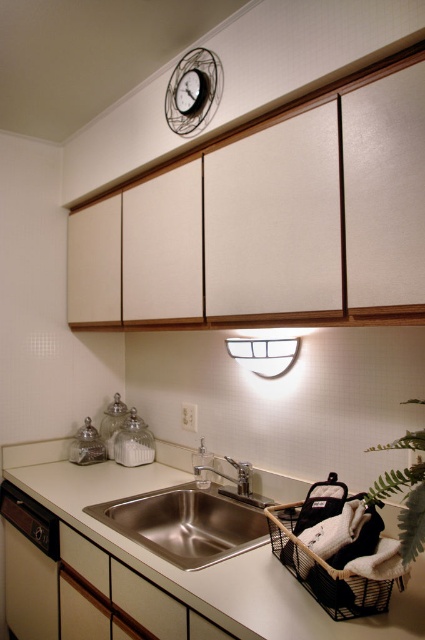
Question: Can you confirm if stainless steel sink at center is positioned to the left of matte black dishwasher at lower left?

Choices:
 (A) no
 (B) yes

Answer: (A)

Question: Estimate the real-world distances between objects in this image. Which object is closer to the silver metallic faucet at center?

Choices:
 (A) metallic wire clock at upper center
 (B) white matte countertop at center

Answer: (B)

Question: Which object appears closest to the camera in this image?

Choices:
 (A) stainless steel sink at center
 (B) silver metallic faucet at center
 (C) metallic wire clock at upper center
 (D) matte black dishwasher at lower left

Answer: (A)

Question: Does green leafy plant at lower right have a larger size compared to silver metallic faucet at center?

Choices:
 (A) no
 (B) yes

Answer: (B)

Question: Is matte black dishwasher at lower left below metallic wire clock at upper center?

Choices:
 (A) no
 (B) yes

Answer: (B)

Question: Which point is closer to the camera?

Choices:
 (A) matte black dishwasher at lower left
 (B) stainless steel sink at center
 (C) white matte countertop at center
 (D) metallic wire clock at upper center

Answer: (C)